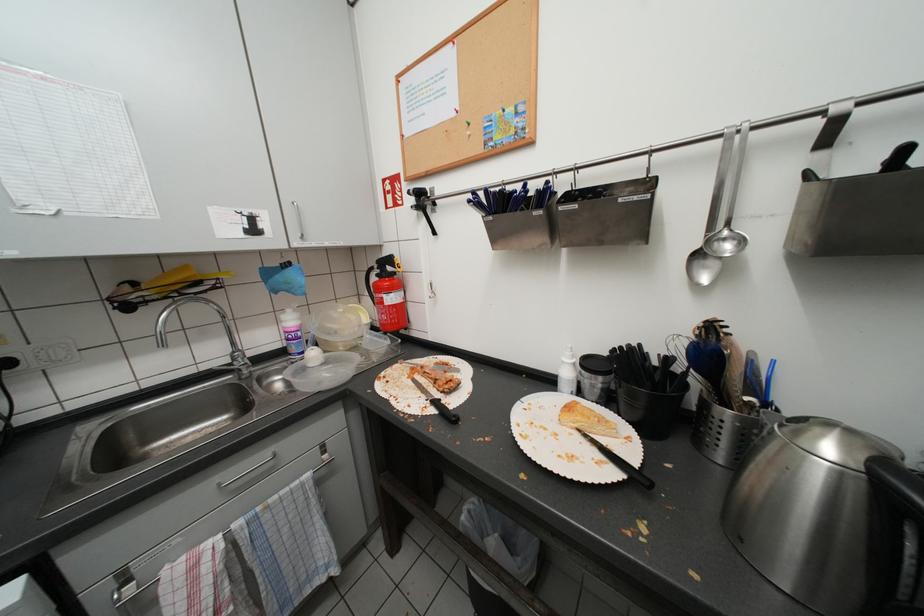
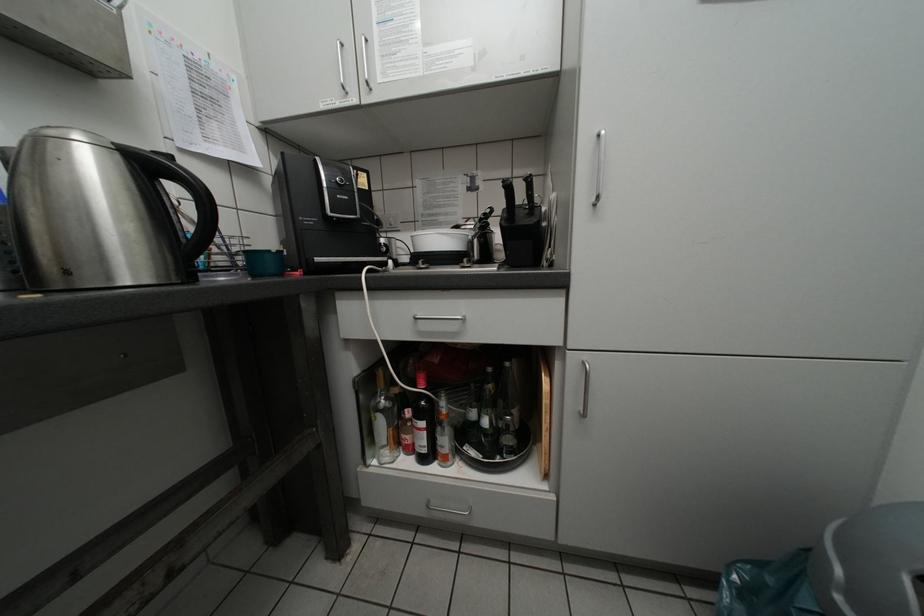
Question: The first image is from the beginning of the video and the second image is from the end. How did the camera likely rotate when shooting the video?

Choices:
 (A) Left
 (B) Right
 (C) Up
 (D) Down

Answer: (B)